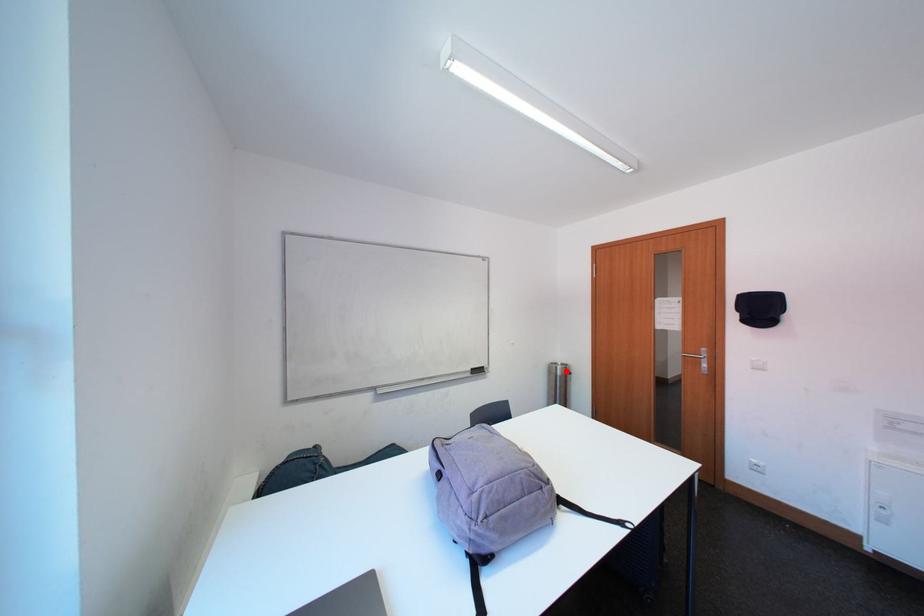
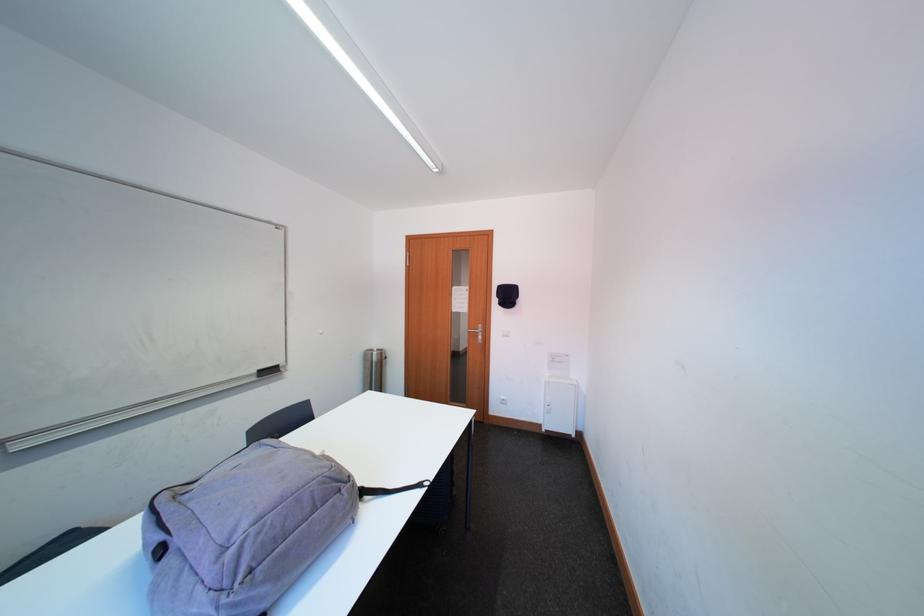
Question: I am providing you with two images of the same scene from different viewpoints. Given a red point in image1, look at the same physical point in image2. Is it:

Choices:
 (A) Closer to the viewpoint
 (B) Farther from the viewpoint

Answer: (B)